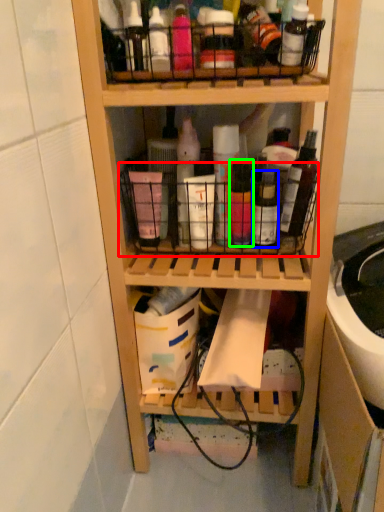
Question: Which object is the farthest from basket (highlighted by a red box)? Choose among these: bottle (highlighted by a blue box) or bottle (highlighted by a green box).

Choices:
 (A) bottle
 (B) bottle

Answer: (A)